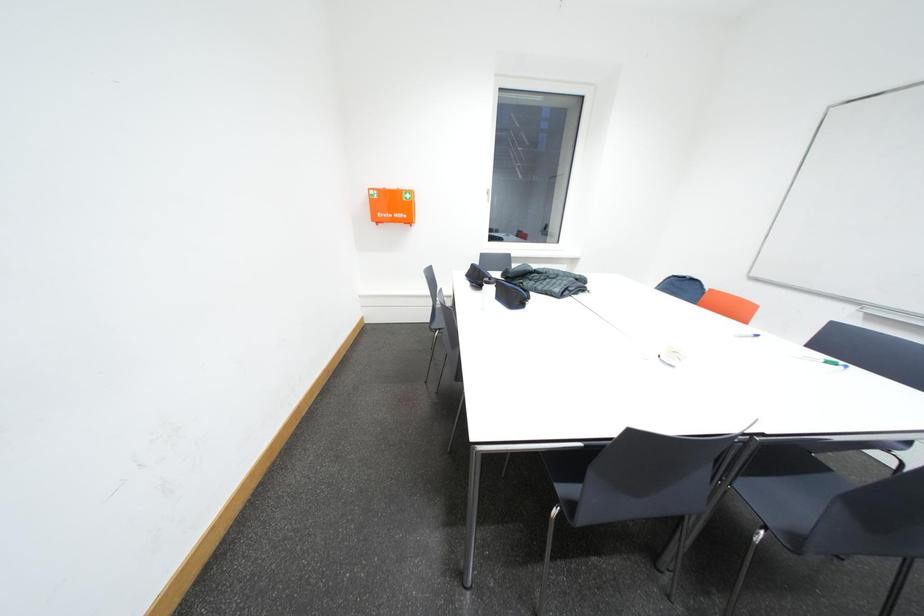
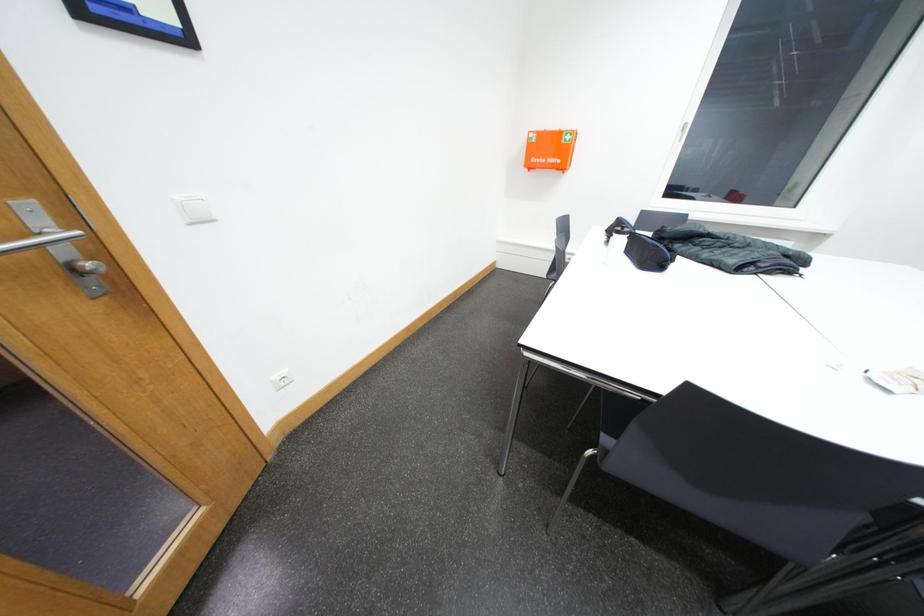
Question: The camera is either moving clockwise (left) or counter-clockwise (right) around the object. The first image is from the beginning of the video and the second image is from the end. Is the camera moving left or right when shooting the video?

Choices:
 (A) Left
 (B) Right

Answer: (B)